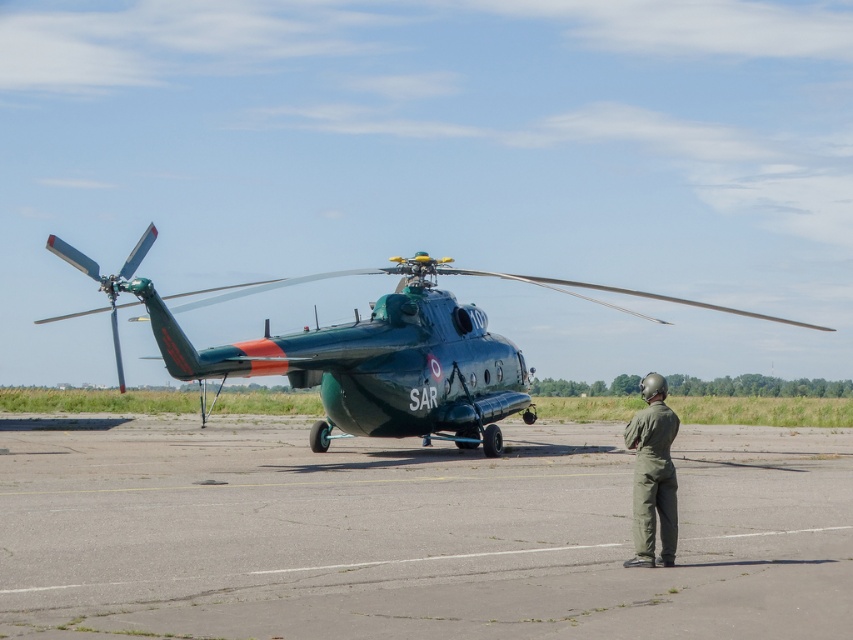
You are a pilot standing at the edge of the airfield and need to locate the green fabric jumpsuit at lower right. Which direction should you look relative to the green metallic helicopter at center?

The green metallic helicopter at center is to the left of the green fabric jumpsuit at lower right, so you should look to the right of the green metallic helicopter at center to find the green fabric jumpsuit at lower right.

You are a rescue team member who needs to quickly board the green metallic helicopter at center. However, there is a green fabric jumpsuit at lower right in your path. Can you step over it without getting too close to the helicopter?

The green metallic helicopter at center is positioned over green fabric jumpsuit at lower right, so stepping over the green fabric jumpsuit at lower right would not bring you too close to the helicopter.